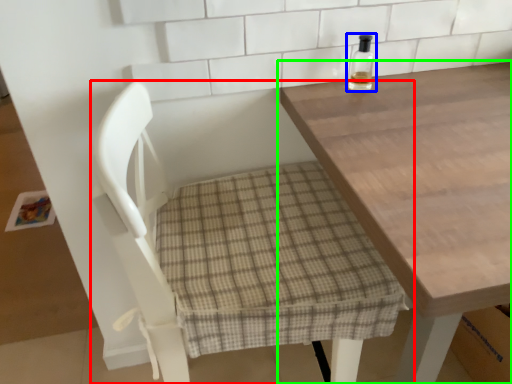
Question: Considering the real-world distances, which object is farthest from chair (highlighted by a red box)? bottle (highlighted by a blue box) or table (highlighted by a green box)?

Choices:
 (A) bottle
 (B) table

Answer: (A)